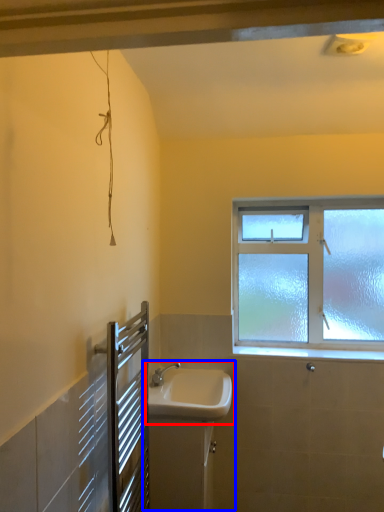
Question: Which object appears closest to the camera in this image, sink (highlighted by a red box) or sink (highlighted by a blue box)?

Choices:
 (A) sink
 (B) sink

Answer: (A)